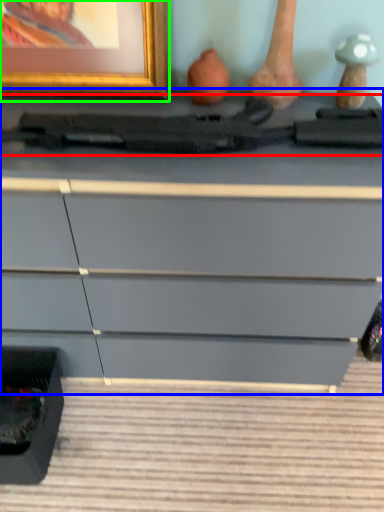
Question: Estimate the real-world distances between objects in this image. Which object is farther from equipment (highlighted by a red box), chest of drawers (highlighted by a blue box) or picture frame (highlighted by a green box)?

Choices:
 (A) chest of drawers
 (B) picture frame

Answer: (A)